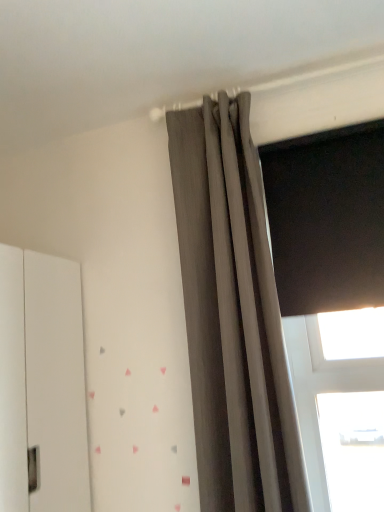
This screenshot has height=512, width=384. In order to click on matte gray curtain at upper center in this screenshot , I will do `click(233, 316)`.

This screenshot has width=384, height=512. What do you see at coordinates (233, 316) in the screenshot?
I see `matte gray curtain at upper center` at bounding box center [233, 316].

Identify the location of matte gray curtain at upper center. (233, 316).